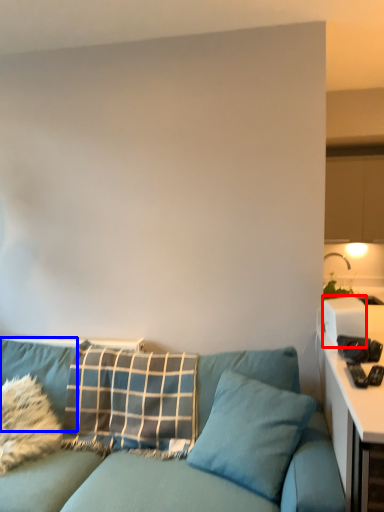
Question: Which object appears farthest to the camera in this image, appliance (highlighted by a red box) or pillow (highlighted by a blue box)?

Choices:
 (A) appliance
 (B) pillow

Answer: (A)